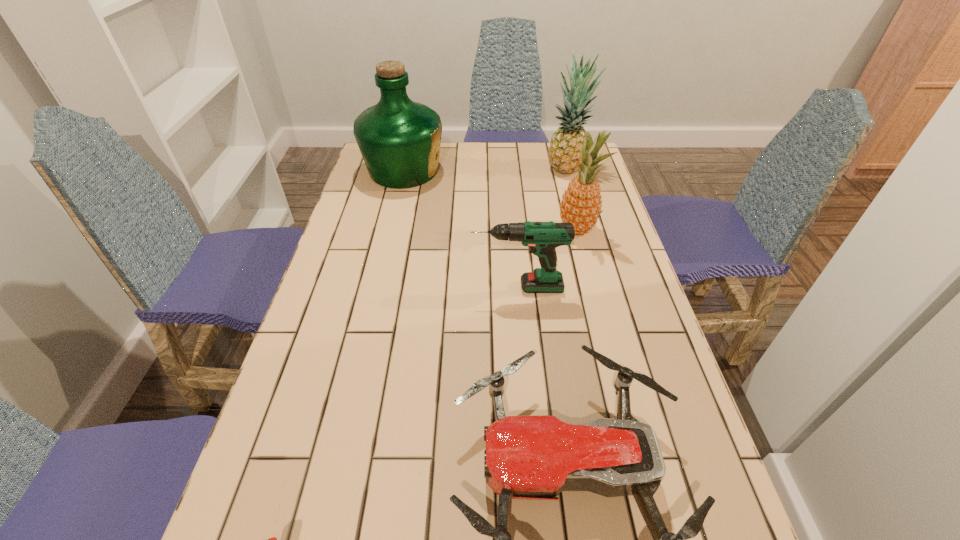
Where is `the farther pineapple`? This screenshot has height=540, width=960. the farther pineapple is located at coordinates (564, 153).

Locate an element on the screen. The width and height of the screenshot is (960, 540). liquor is located at coordinates (399, 139).

Where is `the fourth nearest object`? Image resolution: width=960 pixels, height=540 pixels. the fourth nearest object is located at coordinates (581, 205).

You are a GUI agent. You are given a task and a screenshot of the screen. Output one action in this format:
    pyautogui.click(x=<x>, y=<y>)
    Task: Click on the shorter pineapple
    
    Given the screenshot: What is the action you would take?
    pyautogui.click(x=581, y=205)

At what (x,y) coordinates should I click in order to perform the action: click on the third shortest object. Please return your answer as a coordinate pair (x, y). Looking at the image, I should click on click(x=542, y=237).

The width and height of the screenshot is (960, 540). In order to click on the third nearest object in this screenshot , I will do `click(542, 237)`.

Where is `free region located on the left of the farther pineapple`? This screenshot has width=960, height=540. free region located on the left of the farther pineapple is located at coordinates (529, 168).

The image size is (960, 540). In order to click on free space located 0.260m on the label side of the liquor in this screenshot , I will do `click(519, 171)`.

You are a GUI agent. You are given a task and a screenshot of the screen. Output one action in this format:
    pyautogui.click(x=<x>, y=<y>)
    Task: Click on the vacant space situated on the front of the shorter pineapple
    This screenshot has width=960, height=540.
    Given the screenshot: What is the action you would take?
    pyautogui.click(x=602, y=330)

The width and height of the screenshot is (960, 540). Find the location of `vacant space located on the handle side of the drill`. vacant space located on the handle side of the drill is located at coordinates (396, 287).